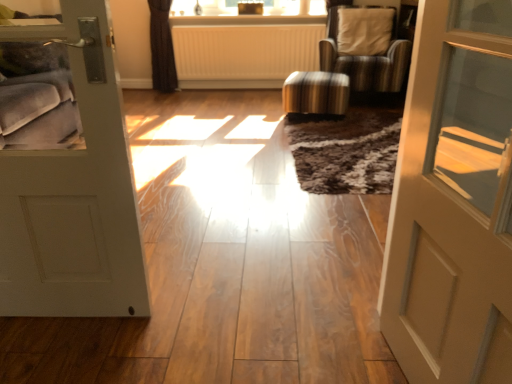
Find the location of `vacant area on top of white ribbed radiator at center (from a real-world perspective)`. vacant area on top of white ribbed radiator at center (from a real-world perspective) is located at coordinates (263, 22).